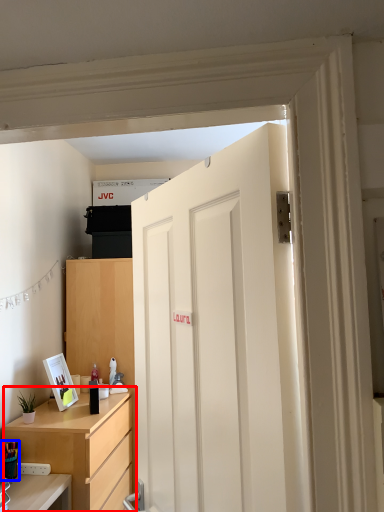
Question: Among these objects, which one is farthest to the camera, cabinetry (highlighted by a red box) or stationery (highlighted by a blue box)?

Choices:
 (A) cabinetry
 (B) stationery

Answer: (A)